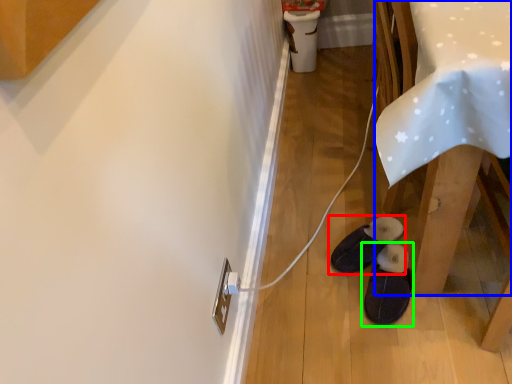
Question: Considering the real-world distances, which object is closest to footwear (highlighted by a red box)? table (highlighted by a blue box) or footwear (highlighted by a green box).

Choices:
 (A) table
 (B) footwear

Answer: (B)